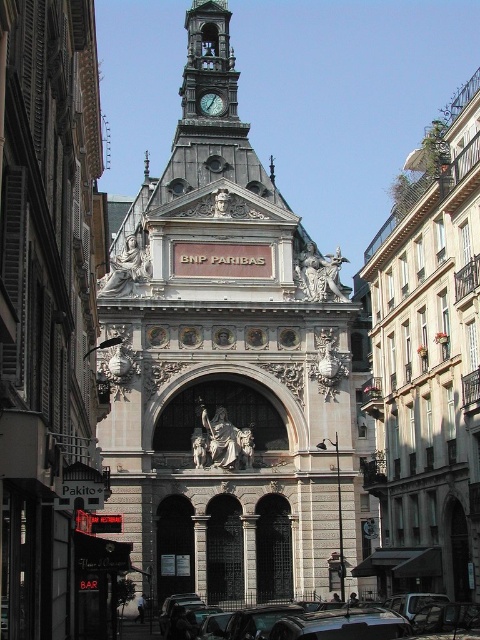
Question: Which object appears farthest from the camera in this image?

Choices:
 (A) white stone church at center
 (B) green glass clock at upper center

Answer: (B)

Question: Does shiny metallic car at center appear over metallic silver car at lower center?

Choices:
 (A) yes
 (B) no

Answer: (A)

Question: Can you confirm if white stone church at center is thinner than green glass clock at upper center?

Choices:
 (A) no
 (B) yes

Answer: (A)

Question: Can you confirm if white stone church at center is smaller than metallic silver car at lower center?

Choices:
 (A) yes
 (B) no

Answer: (B)

Question: Which point is farther to the camera?

Choices:
 (A) (182, 150)
 (B) (23, 250)
 (C) (222, 112)
 (D) (388, 257)

Answer: (C)

Question: Which object is positioned closest to the white marble church at center?

Choices:
 (A) white stone church at center
 (B) green glass clock at upper center
 (C) metallic silver car at lower center
 (D) shiny metallic car at center

Answer: (D)